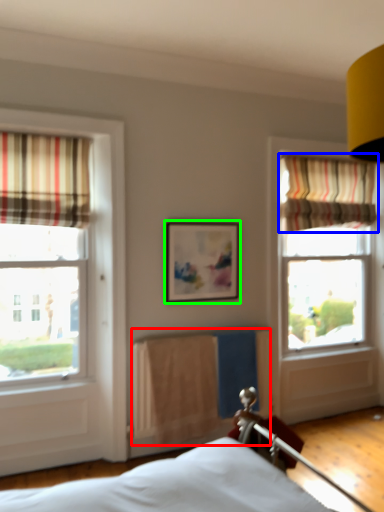
Question: Based on their relative distances, which object is farther from radiator (highlighted by a red box)? Choose from curtain (highlighted by a blue box) and picture frame (highlighted by a green box).

Choices:
 (A) curtain
 (B) picture frame

Answer: (A)